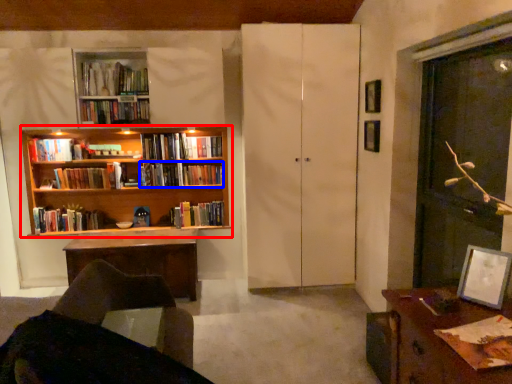
Question: Among these objects, which one is farthest to the camera, bookcase (highlighted by a red box) or book (highlighted by a blue box)?

Choices:
 (A) bookcase
 (B) book

Answer: (B)